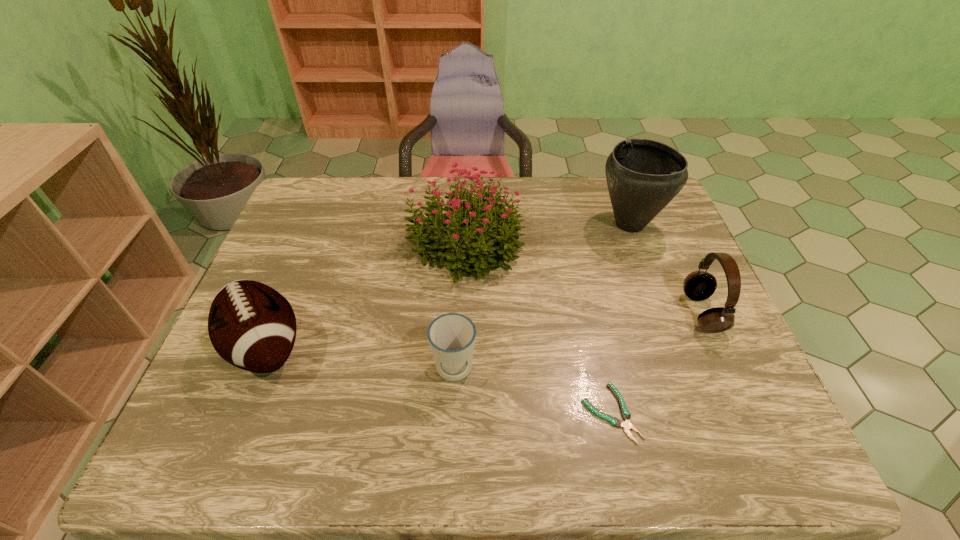
I want to click on free location that satisfies the following two spatial constraints: 1. on the front side of the bouquet; 2. on the left side of the pliers, so click(x=459, y=413).

The image size is (960, 540). Find the location of `free region that satisfies the following two spatial constraints: 1. with a handle on the side of the pliers; 2. on the left side of the cup`. free region that satisfies the following two spatial constraints: 1. with a handle on the side of the pliers; 2. on the left side of the cup is located at coordinates (452, 413).

At what (x,y) coordinates should I click in order to perform the action: click on vacant region that satisfies the following two spatial constraints: 1. on the ear pads of the headset; 2. with a handle on the side of the fifth tallest object. Please return your answer as a coordinate pair (x, y). The width and height of the screenshot is (960, 540). Looking at the image, I should click on (728, 370).